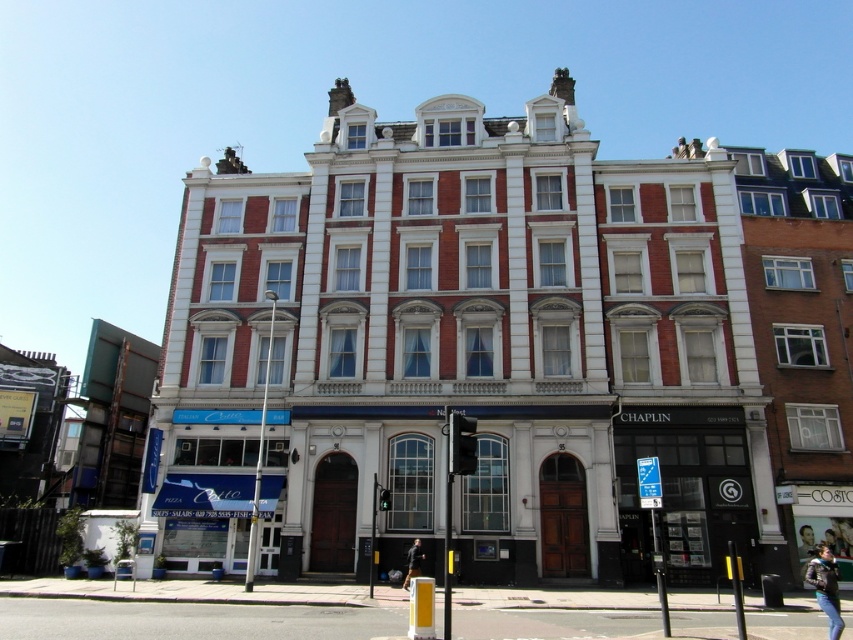
Can you confirm if black leather jacket at lower center is bigger than smooth skin face at center?

No.

Is black leather jacket at lower center smaller than smooth skin face at center?

Correct, black leather jacket at lower center occupies less space than smooth skin face at center.

At what (x,y) coordinates should I click in order to perform the action: click on black leather jacket at lower center. Please return your answer as a coordinate pair (x, y). The image size is (853, 640). Looking at the image, I should click on (413, 561).

Can you confirm if leather jacket at lower right is positioned above black leather jacket at lower center?

Indeed, leather jacket at lower right is positioned over black leather jacket at lower center.

This screenshot has width=853, height=640. Describe the element at coordinates (825, 586) in the screenshot. I see `leather jacket at lower right` at that location.

Where is `leather jacket at lower right`? This screenshot has width=853, height=640. leather jacket at lower right is located at coordinates (825, 586).

Does leather jacket at lower right have a smaller size compared to smooth skin face at center?

No.

Who is positioned more to the left, leather jacket at lower right or smooth skin face at center?

Positioned to the left is leather jacket at lower right.

What are the coordinates of `leather jacket at lower right` in the screenshot? It's located at (825, 586).